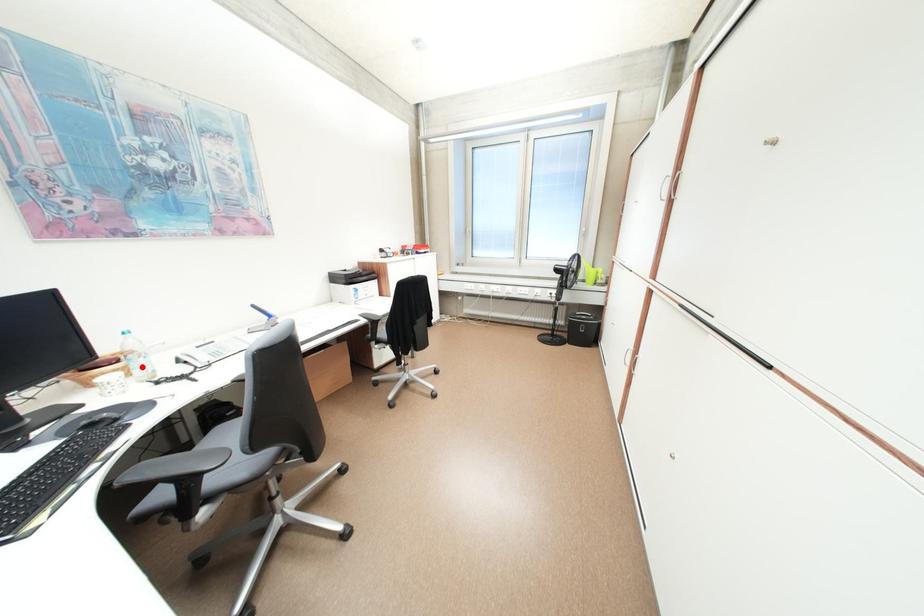
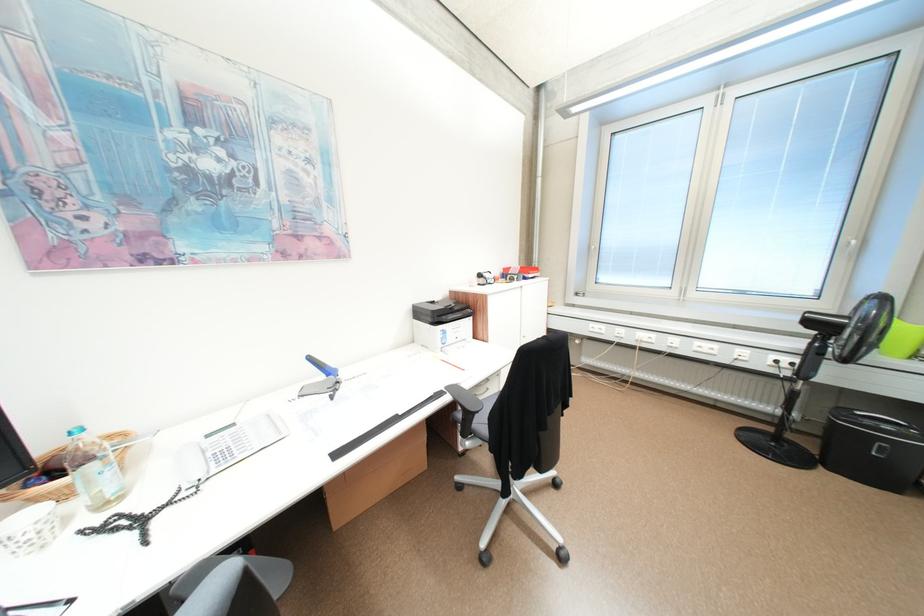
Where in the second image is the point corresponding to the highlighted location from the first image?

(91, 487)